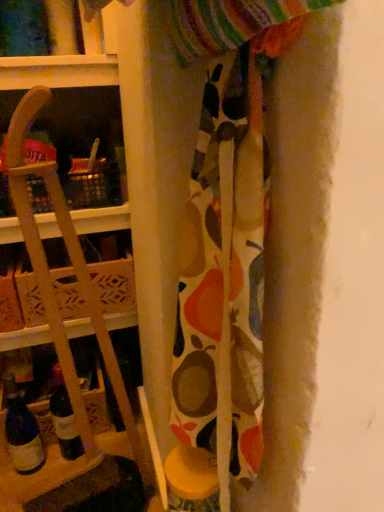
Question: In the image, is wooden at left on the left side or the right side of patterned fabric at center?

Choices:
 (A) right
 (B) left

Answer: (B)

Question: Is wooden at left situated inside patterned fabric at center or outside?

Choices:
 (A) outside
 (B) inside

Answer: (A)

Question: Based on their relative distances, which object is farther from the patterned fabric at center?

Choices:
 (A) wooden at left
 (B) wooden crate at left
 (C) translucent glass wine bottle at lower left

Answer: (C)

Question: Which is nearer to the wooden at left?

Choices:
 (A) patterned fabric at center
 (B) wooden crate at left
 (C) translucent glass wine bottle at lower left

Answer: (B)